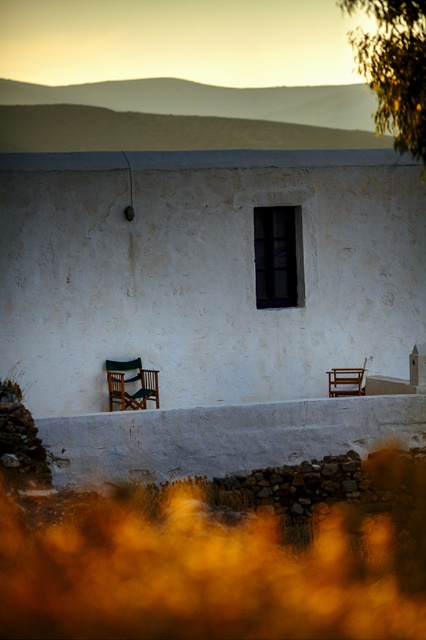
Question: Does wooden folding chair at lower left appear over wooden chair at lower right?

Choices:
 (A) yes
 (B) no

Answer: (B)

Question: Which point is farther from the camera taking this photo?

Choices:
 (A) (334, 372)
 (B) (132, 369)

Answer: (A)

Question: Is wooden folding chair at lower left thinner than wooden chair at lower right?

Choices:
 (A) no
 (B) yes

Answer: (A)

Question: Does wooden folding chair at lower left have a larger size compared to wooden chair at lower right?

Choices:
 (A) yes
 (B) no

Answer: (A)

Question: Which object is closer to the camera taking this photo?

Choices:
 (A) wooden chair at lower right
 (B) wooden folding chair at lower left

Answer: (B)